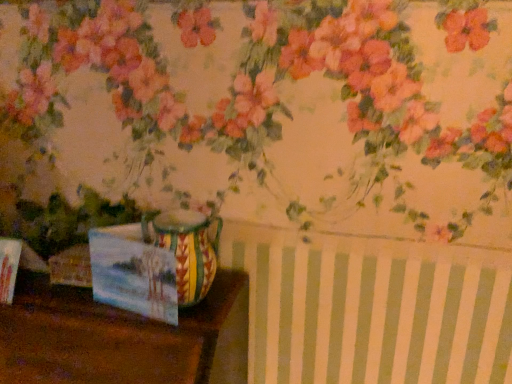
Locate an element on the screen. The width and height of the screenshot is (512, 384). free region on the left part of multicolored ceramic vase at center is located at coordinates [x=65, y=311].